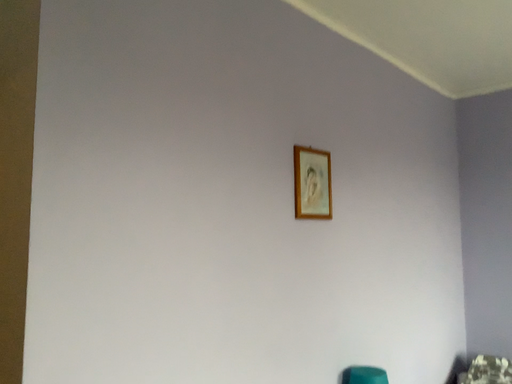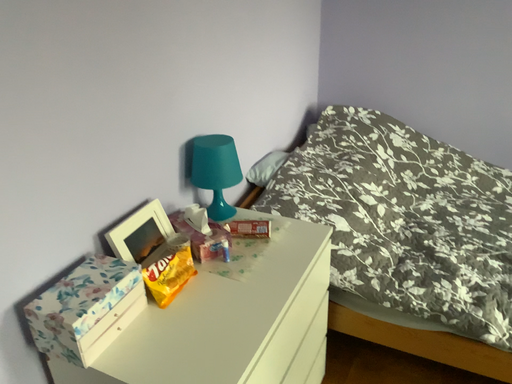
Question: Which way did the camera rotate in the video?

Choices:
 (A) rotated downward
 (B) rotated upward

Answer: (A)